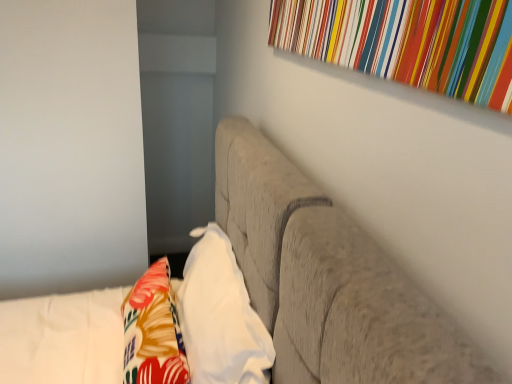
Describe the element at coordinates (327, 279) in the screenshot. I see `textured gray sofa at center` at that location.

Where is `multicolored striped fabric at upper right`? multicolored striped fabric at upper right is located at coordinates (408, 42).

In the scene shown: Measure the distance between white soft pillow at center and camera.

The depth of white soft pillow at center is 36.54 inches.

Locate an element on the screen. Image resolution: width=512 pixels, height=384 pixels. textured gray sofa at center is located at coordinates (327, 279).

Which object is thinner, textured gray sofa at center or multicolored striped fabric at upper right?

multicolored striped fabric at upper right.

Who is bigger, textured gray sofa at center or multicolored striped fabric at upper right?

With larger size is textured gray sofa at center.

Is textured gray sofa at center positioned beyond the bounds of multicolored striped fabric at upper right?

Yes, textured gray sofa at center is located beyond the bounds of multicolored striped fabric at upper right.

Is white soft pillow at center outside of floral fabric throw pillow at lower left?

Yes, white soft pillow at center is outside of floral fabric throw pillow at lower left.

Considering the sizes of objects white soft pillow at center and floral fabric throw pillow at lower left in the image provided, who is wider, white soft pillow at center or floral fabric throw pillow at lower left?

With larger width is floral fabric throw pillow at lower left.

Is floral fabric throw pillow at lower left at the back of white soft pillow at center?

Correct, white soft pillow at center is looking away from floral fabric throw pillow at lower left.

Is white soft pillow at center taller or shorter than floral fabric throw pillow at lower left?

In the image, white soft pillow at center appears to be taller than floral fabric throw pillow at lower left.

In the scene shown: Is floral fabric throw pillow at lower left not inside multicolored striped fabric at upper right?

Yes, floral fabric throw pillow at lower left is not within multicolored striped fabric at upper right.

From the image's perspective, which is below, floral fabric throw pillow at lower left or multicolored striped fabric at upper right?

floral fabric throw pillow at lower left, from the image's perspective.

You are a GUI agent. You are given a task and a screenshot of the screen. Output one action in this format:
    pyautogui.click(x=<x>, y=<y>)
    Task: Click on the throw pillow lying on the left of multicolored striped fabric at upper right
    
    Given the screenshot: What is the action you would take?
    pyautogui.click(x=153, y=331)

Consider the image. How different are the orientations of floral fabric throw pillow at lower left and multicolored striped fabric at upper right in degrees?

3.48 degrees separate the facing orientations of floral fabric throw pillow at lower left and multicolored striped fabric at upper right.

Is point (413, 0) farther from camera compared to point (187, 374)?

No, (413, 0) is in front of (187, 374).

The image size is (512, 384). Identify the location of curtain in front of the floral fabric throw pillow at lower left. (408, 42).

From a real-world perspective, relative to floral fabric throw pillow at lower left, is multicolored striped fabric at upper right vertically above or below?

From a real-world perspective, multicolored striped fabric at upper right is physically above floral fabric throw pillow at lower left.

Consider the image. How different are the orientations of floral fabric throw pillow at lower left and textured gray sofa at center in degrees?

The facing directions of floral fabric throw pillow at lower left and textured gray sofa at center are 3.72 degrees apart.

You are a GUI agent. You are given a task and a screenshot of the screen. Output one action in this format:
    pyautogui.click(x=<x>, y=<y>)
    Task: Click on the throw pillow behind the textured gray sofa at center
    The height and width of the screenshot is (384, 512).
    Given the screenshot: What is the action you would take?
    pyautogui.click(x=153, y=331)

Is floral fabric throw pillow at lower left far from textured gray sofa at center?

That's not correct — floral fabric throw pillow at lower left is a little close to textured gray sofa at center.

Which object is wider, floral fabric throw pillow at lower left or textured gray sofa at center?

textured gray sofa at center.

Considering the relative positions of textured gray sofa at center and white soft pillow at center in the image provided, is textured gray sofa at center to the left of white soft pillow at center from the viewer's perspective?

Yes, textured gray sofa at center is to the left of white soft pillow at center.

Based on the photo, is textured gray sofa at center outside of white soft pillow at center?

Yes, textured gray sofa at center is outside of white soft pillow at center.

Could you tell me if textured gray sofa at center is turned towards white soft pillow at center?

Yes, textured gray sofa at center is aimed at white soft pillow at center.

Is textured gray sofa at center taller than white soft pillow at center?

Indeed, textured gray sofa at center has a greater height compared to white soft pillow at center.

Is textured gray sofa at center completely or partially outside of floral fabric throw pillow at lower left?

Indeed, textured gray sofa at center is completely outside floral fabric throw pillow at lower left.

Considering the points (270, 207) and (135, 300), which point is in front, point (270, 207) or point (135, 300)?

The point (270, 207) is more forward.

In the scene shown: Measure the distance from textured gray sofa at center to floral fabric throw pillow at lower left.

The distance of textured gray sofa at center from floral fabric throw pillow at lower left is 42.36 centimeters.

Looking at this image, is textured gray sofa at center not close to floral fabric throw pillow at lower left?

textured gray sofa at center is near floral fabric throw pillow at lower left, not far away.

Where is `curtain that appears on the right of textured gray sofa at center`? Image resolution: width=512 pixels, height=384 pixels. curtain that appears on the right of textured gray sofa at center is located at coordinates (408, 42).

The width and height of the screenshot is (512, 384). Find the location of `throw pillow below the white soft pillow at center (from a real-world perspective)`. throw pillow below the white soft pillow at center (from a real-world perspective) is located at coordinates (153, 331).

Based on their spatial positions, is textured gray sofa at center or multicolored striped fabric at upper right closer to floral fabric throw pillow at lower left?

A: textured gray sofa at center lies closer to floral fabric throw pillow at lower left than the other object.

Based on their spatial positions, is white soft pillow at center or floral fabric throw pillow at lower left further from textured gray sofa at center?

Based on the image, floral fabric throw pillow at lower left appears to be further to textured gray sofa at center.

Estimate the real-world distances between objects in this image. Which object is closer to floral fabric throw pillow at lower left, multicolored striped fabric at upper right or textured gray sofa at center?

textured gray sofa at center.

From the image, which object appears to be farther from floral fabric throw pillow at lower left, textured gray sofa at center or white soft pillow at center?

textured gray sofa at center.

When comparing their distances from floral fabric throw pillow at lower left, does multicolored striped fabric at upper right or white soft pillow at center seem further?

The object further to floral fabric throw pillow at lower left is multicolored striped fabric at upper right.

When comparing their distances from textured gray sofa at center, does white soft pillow at center or multicolored striped fabric at upper right seem closer?

Among the two, white soft pillow at center is located nearer to textured gray sofa at center.

Considering their positions, is floral fabric throw pillow at lower left positioned closer to textured gray sofa at center than white soft pillow at center?

The object closer to textured gray sofa at center is white soft pillow at center.

Considering their positions, is floral fabric throw pillow at lower left positioned further to multicolored striped fabric at upper right than white soft pillow at center?

floral fabric throw pillow at lower left lies further to multicolored striped fabric at upper right than the other object.

Locate an element on the screen. throw pillow between multicolored striped fabric at upper right and textured gray sofa at center from top to bottom is located at coordinates (153, 331).

You are a GUI agent. You are given a task and a screenshot of the screen. Output one action in this format:
    pyautogui.click(x=<x>, y=<y>)
    Task: Click on the pillow between textured gray sofa at center and floral fabric throw pillow at lower left from front to back
    The height and width of the screenshot is (384, 512).
    Given the screenshot: What is the action you would take?
    pyautogui.click(x=220, y=316)

Where is `pillow between multicolored striped fabric at upper right and floral fabric throw pillow at lower left vertically`? The width and height of the screenshot is (512, 384). pillow between multicolored striped fabric at upper right and floral fabric throw pillow at lower left vertically is located at coordinates (220, 316).

This screenshot has height=384, width=512. I want to click on pillow between multicolored striped fabric at upper right and textured gray sofa at center in the vertical direction, so click(x=220, y=316).